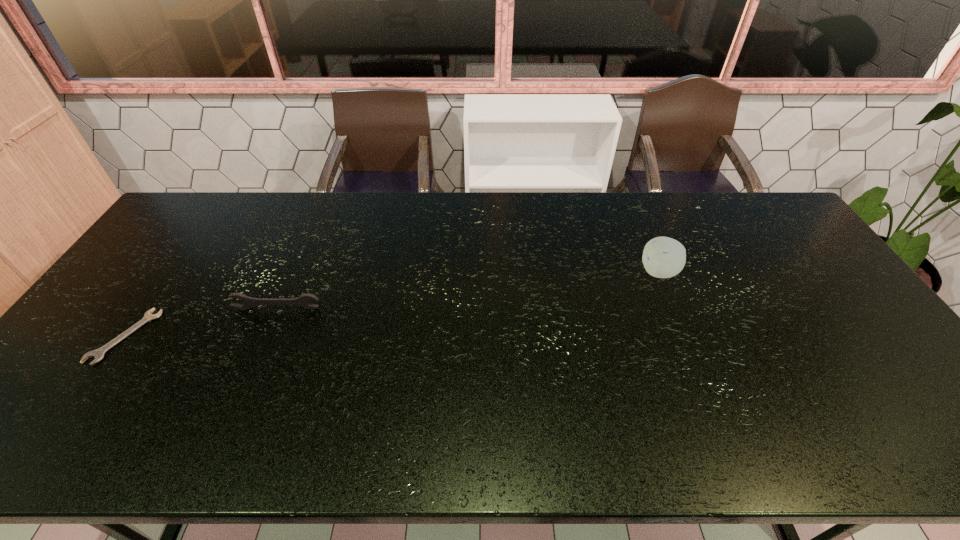
In the image, there is a desktop. Where is `free space at the far edge`? free space at the far edge is located at coordinates (255, 231).

At what (x,y) coordinates should I click in order to perform the action: click on vacant space at the near edge. Please return your answer as a coordinate pair (x, y). Looking at the image, I should click on (230, 433).

The height and width of the screenshot is (540, 960). Identify the location of free spot at the left edge of the desktop. (83, 347).

In the image, there is a desktop. At what (x,y) coordinates should I click in order to perform the action: click on free space at the right edge. Please return your answer as a coordinate pair (x, y). Looking at the image, I should click on (788, 253).

Find the location of `free space between the leftmost object and the right wrench`. free space between the leftmost object and the right wrench is located at coordinates (201, 322).

At what (x,y) coordinates should I click in order to perform the action: click on empty space that is in between the shortest object and the rightmost object. Please return your answer as a coordinate pair (x, y). The height and width of the screenshot is (540, 960). Looking at the image, I should click on (392, 304).

Where is `empty location between the left wrench and the second tallest object`? empty location between the left wrench and the second tallest object is located at coordinates (201, 322).

You are a GUI agent. You are given a task and a screenshot of the screen. Output one action in this format:
    pyautogui.click(x=<x>, y=<y>)
    Task: Click on the free area in between the shorter wrench and the taller wrench
    This screenshot has height=540, width=960.
    Given the screenshot: What is the action you would take?
    pyautogui.click(x=201, y=322)

Locate an element on the screen. Image resolution: width=960 pixels, height=540 pixels. empty space that is in between the rightmost object and the right wrench is located at coordinates (468, 291).

This screenshot has width=960, height=540. I want to click on empty space between the apple and the shortest object, so click(392, 304).